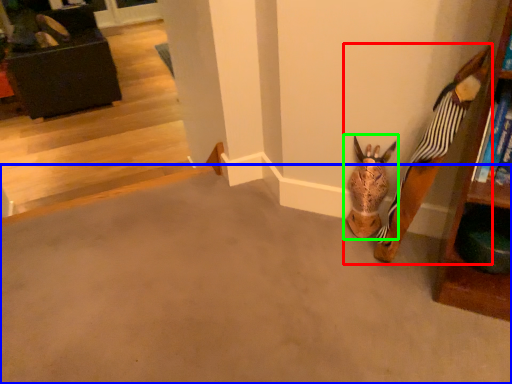
Question: Considering the real-world distances, which object is farthest from toy (highlighted by a red box)? concrete (highlighted by a blue box) or animal (highlighted by a green box)?

Choices:
 (A) concrete
 (B) animal

Answer: (A)